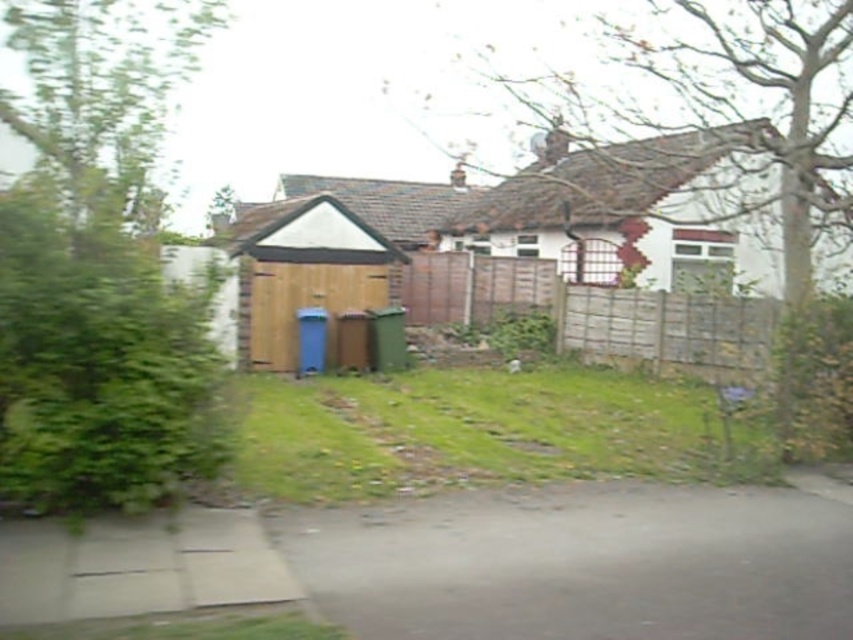
Is brown leafy tree at upper center below green leafy tree at upper left?

No, brown leafy tree at upper center is not below green leafy tree at upper left.

Consider the image. Between brown leafy tree at upper center and green leafy tree at upper left, which one is positioned higher?

brown leafy tree at upper center is higher up.

Locate an element on the screen. Image resolution: width=853 pixels, height=640 pixels. brown leafy tree at upper center is located at coordinates coord(730,160).

Where is `brown leafy tree at upper center`? brown leafy tree at upper center is located at coordinates (730, 160).

Which of these two, green leafy tree at left or green leafy tree at upper left, stands shorter?

green leafy tree at upper left

Is the position of green leafy tree at left less distant than that of green leafy tree at upper left?

Yes.

Find the location of a particular element. The image size is (853, 640). green leafy tree at left is located at coordinates (99, 268).

Which is below, green leafy tree at left or brown leafy tree at upper center?

green leafy tree at left is lower down.

Between green leafy tree at left and brown leafy tree at upper center, which one appears on the right side from the viewer's perspective?

brown leafy tree at upper center

At what (x,y) coordinates should I click in order to perform the action: click on green leafy tree at left. Please return your answer as a coordinate pair (x, y). This screenshot has height=640, width=853. Looking at the image, I should click on (99, 268).

Image resolution: width=853 pixels, height=640 pixels. I want to click on green leafy tree at left, so click(99, 268).